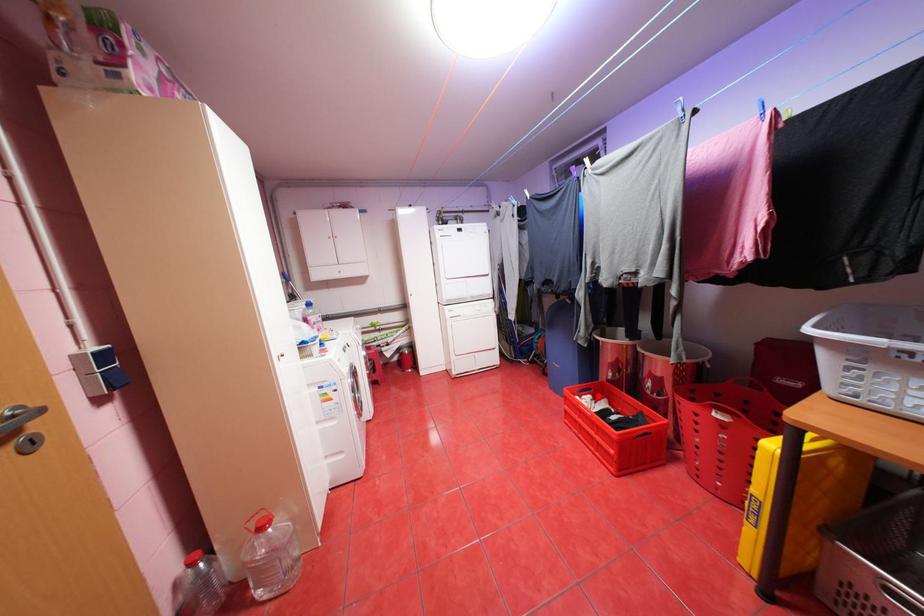
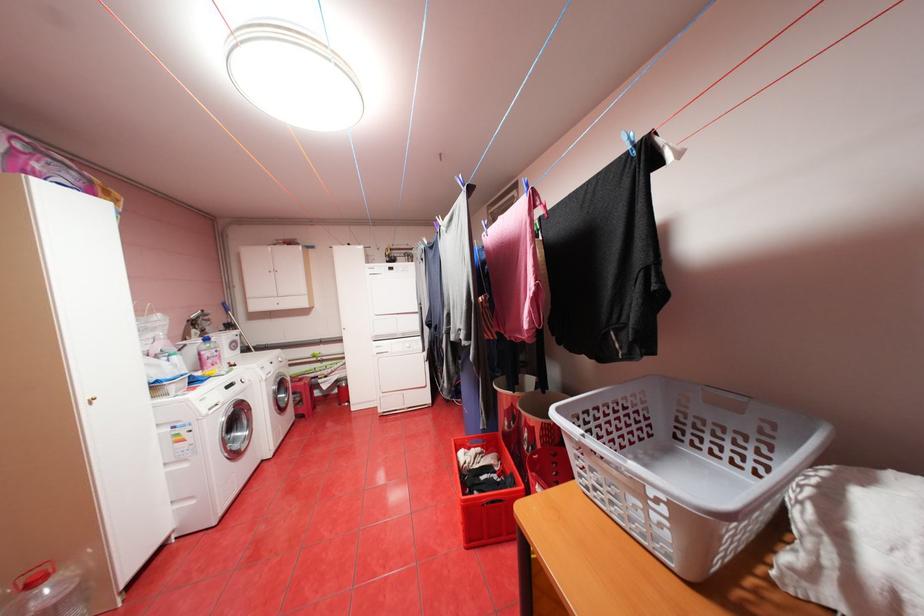
Find the pixel in the second image that matches the highlighted location in the first image.

(488, 448)